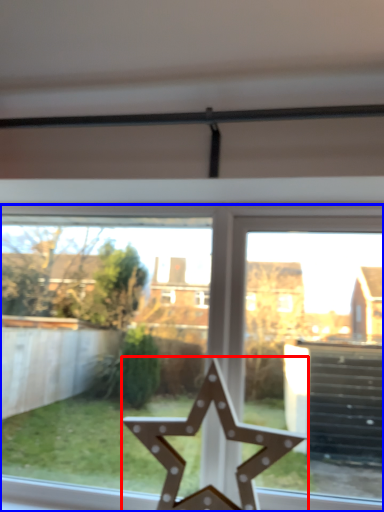
Question: Which object is closer to the camera taking this photo, star (highlighted by a red box) or window (highlighted by a blue box)?

Choices:
 (A) star
 (B) window

Answer: (A)